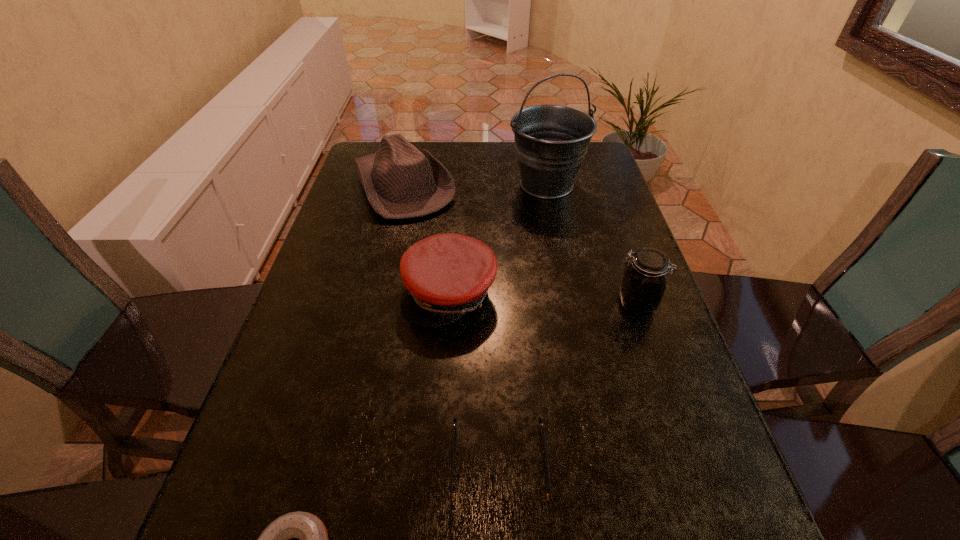
Image resolution: width=960 pixels, height=540 pixels. Identify the location of vacant space in between the fedora and the bucket. (475, 185).

Locate an element on the screen. Image resolution: width=960 pixels, height=540 pixels. object that stands as the fourth closest to the jar is located at coordinates (400, 181).

Choose which object is the nearest neighbor to the jar. Please provide its 2D coordinates. Your answer should be formatted as a tuple, i.e. [(x, y)], where the tuple contains the x and y coordinates of a point satisfying the conditions above.

[(446, 276)]

Where is `vacant point that satisfies the following two spatial constraints: 1. on the lid of the jar; 2. at the hinge ends of the second shortest object`? The image size is (960, 540). vacant point that satisfies the following two spatial constraints: 1. on the lid of the jar; 2. at the hinge ends of the second shortest object is located at coordinates (692, 465).